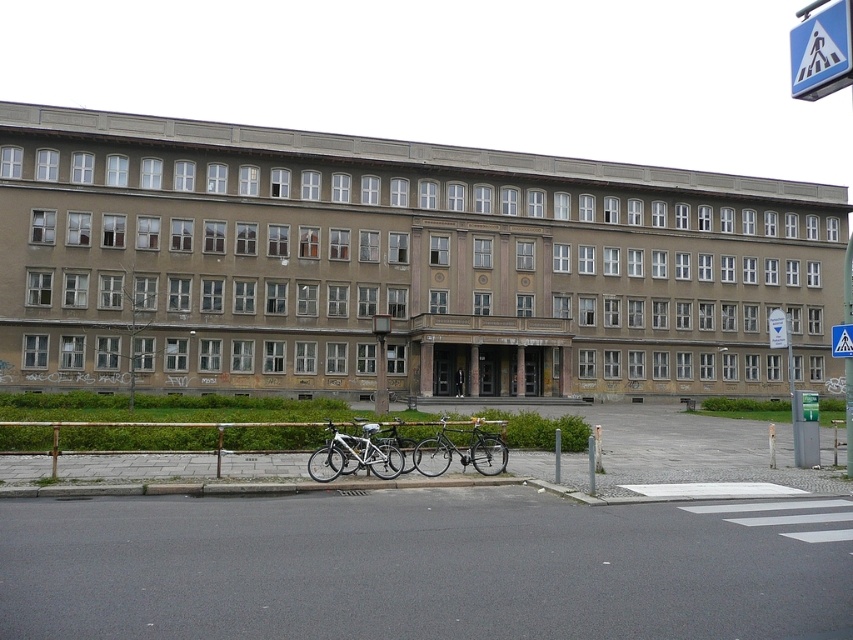
Question: Is shiny silver bicycle at center smaller than black leather jacket at center?

Choices:
 (A) no
 (B) yes

Answer: (A)

Question: Which point is farther from the camera taking this photo?

Choices:
 (A) (457, 392)
 (B) (434, 454)
 (C) (825, 51)

Answer: (A)

Question: Among these objects, which one is farthest from the camera?

Choices:
 (A) shiny silver bicycle at center
 (B) white plastic pedestrian crossing sign at upper right

Answer: (B)

Question: Which point is farther from the camera taking this photo?

Choices:
 (A) (383, 436)
 (B) (454, 387)
 (C) (381, 470)
 (D) (825, 44)

Answer: (B)

Question: Does white plastic pedestrian crossing sign at upper right have a smaller size compared to silver metallic bicycle at center?

Choices:
 (A) no
 (B) yes

Answer: (A)

Question: Observing the image, what is the correct spatial positioning of white matte bicycle at lower center in reference to silver metallic bicycle at center?

Choices:
 (A) right
 (B) left

Answer: (B)